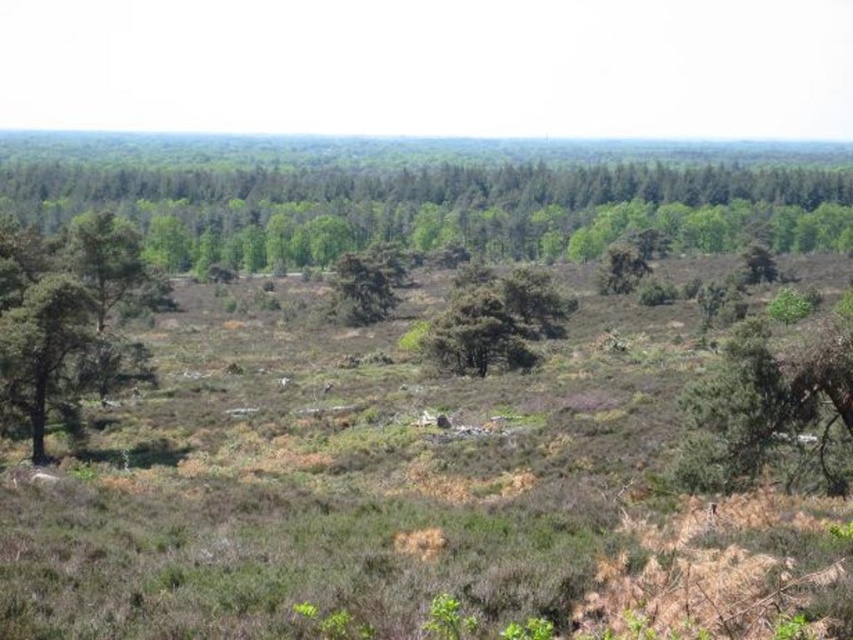
Can you confirm if green rough bark tree at left is thinner than green leafy tree at center-right?

In fact, green rough bark tree at left might be wider than green leafy tree at center-right.

In order to click on green rough bark tree at left in this screenshot , I will do `click(68, 320)`.

Between green leafy trees at upper center and green leafy tree at right, which one appears on the left side from the viewer's perspective?

green leafy trees at upper center is more to the left.

Does green leafy trees at upper center come in front of green leafy tree at right?

No, it is behind green leafy tree at right.

The height and width of the screenshot is (640, 853). What do you see at coordinates (428, 205) in the screenshot? I see `green leafy trees at upper center` at bounding box center [428, 205].

You are a GUI agent. You are given a task and a screenshot of the screen. Output one action in this format:
    pyautogui.click(x=<x>, y=<y>)
    Task: Click on the green leafy trees at upper center
    
    Given the screenshot: What is the action you would take?
    pyautogui.click(x=428, y=205)

Who is higher up, green rough bark tree at left or green leafy tree at right?

Positioned higher is green rough bark tree at left.

From the picture: Can you confirm if green rough bark tree at left is positioned to the right of green leafy tree at right?

In fact, green rough bark tree at left is to the left of green leafy tree at right.

Does point (26, 284) lie in front of point (701, 451)?

No, it is behind (701, 451).

Identify the location of green rough bark tree at left. (68, 320).